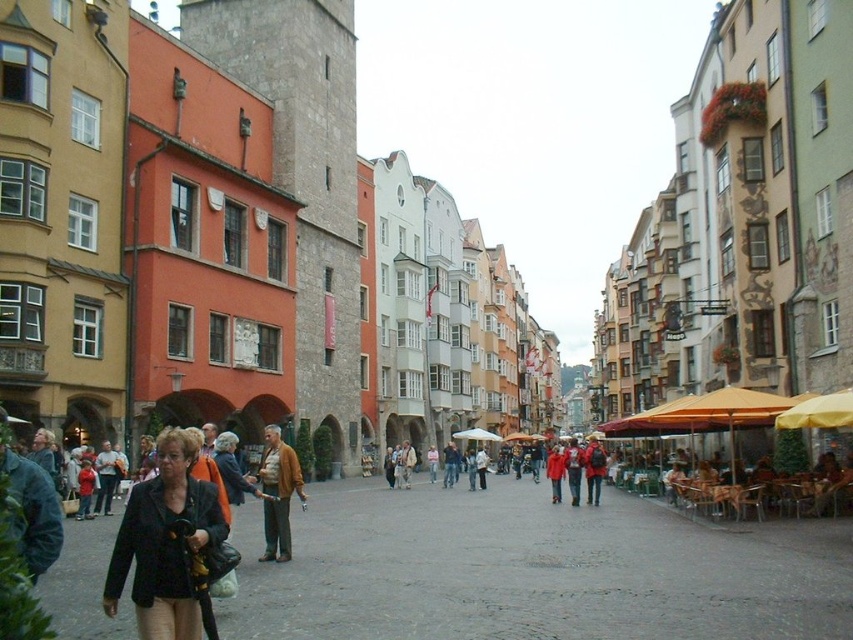
You are a tourist standing on the cobblestone street in the European town. You see a black fabric jacket at lower left. Where exactly is the black fabric jacket located in the scene?

The black fabric jacket at lower left is located at point (167, 545) in the scene.

You are a tourist walking down the street and see the brown leather jacket at lower left and the red backpack at center. Which object is closer to you?

A: The brown leather jacket at lower left is closer to you because it is in front of the red backpack at center.